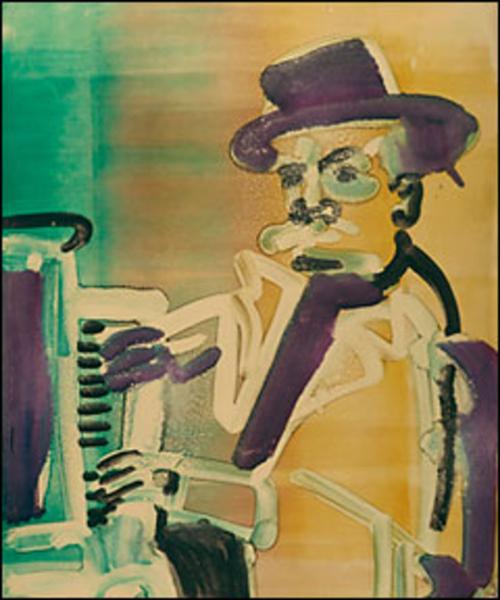
Locate an element on the screen. white piano keys is located at coordinates (111, 331), (115, 402), (116, 436).